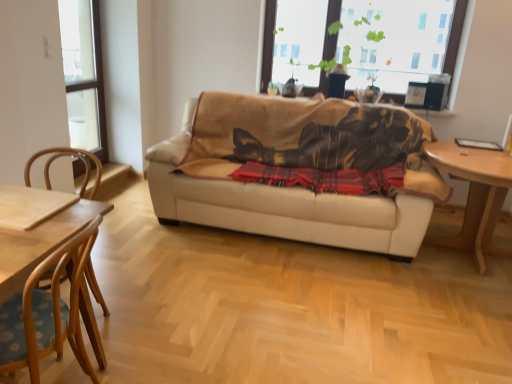
Image resolution: width=512 pixels, height=384 pixels. I want to click on vacant area that is in front of beige leather couch at center, so coord(292,301).